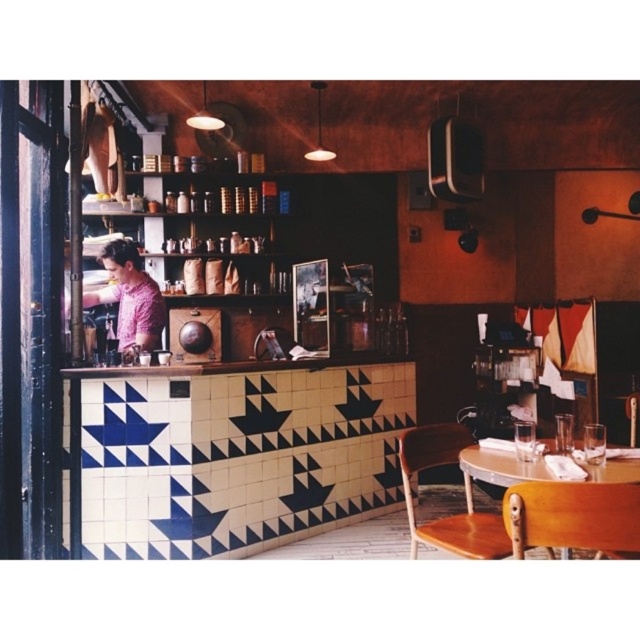
What do you see at coordinates (129, 298) in the screenshot? I see `pink textured shirt at left` at bounding box center [129, 298].

Who is taller, pink textured shirt at left or wooden table at lower right?

Standing taller between the two is pink textured shirt at left.

Is point (113, 294) positioned in front of point (612, 474)?

No, it is behind (612, 474).

Identify the location of pink textured shirt at left. The width and height of the screenshot is (640, 640). (129, 298).